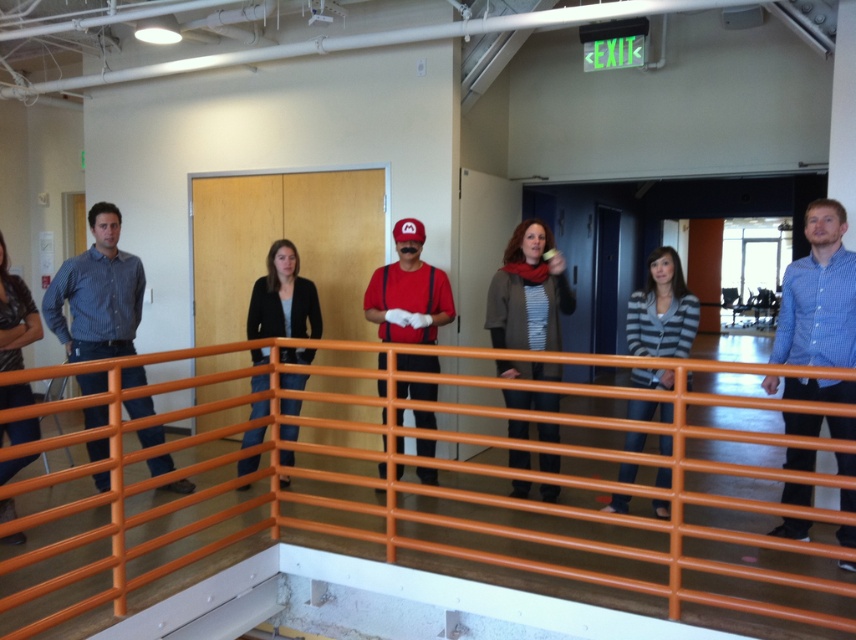
Between orange plastic rail at center and blue checkered shirt at right, which one appears on the right side from the viewer's perspective?

blue checkered shirt at right

You are a GUI agent. You are given a task and a screenshot of the screen. Output one action in this format:
    pyautogui.click(x=<x>, y=<y>)
    Task: Click on the orange plastic rail at center
    Image resolution: width=856 pixels, height=640 pixels.
    Given the screenshot: What is the action you would take?
    pyautogui.click(x=428, y=531)

Is point (785, 593) farther from viewer compared to point (810, 524)?

That is False.

Where is `orange plastic rail at center`? orange plastic rail at center is located at coordinates (428, 531).

Which is in front, point (373, 484) or point (9, 392)?

Positioned in front is point (373, 484).

Is point (146, 550) positioned behind point (4, 310)?

No, (146, 550) is in front of (4, 310).

Where is `orange plastic rail at center`? The image size is (856, 640). orange plastic rail at center is located at coordinates (428, 531).

Is point (156, 584) more distant than point (435, 294)?

No, it is in front of (435, 294).

Which is in front, point (123, 598) or point (419, 234)?

Positioned in front is point (123, 598).

This screenshot has height=640, width=856. In order to click on orange plastic rail at center in this screenshot , I will do (428, 531).